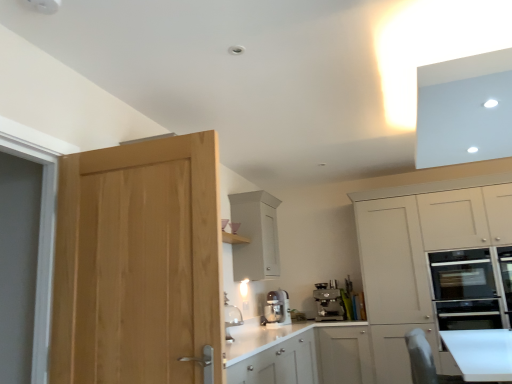
Question: Does natural wood door at left have a greater height compared to satin silver mixer at center, the second kitchen appliance viewed from the right?

Choices:
 (A) no
 (B) yes

Answer: (B)

Question: Are natural wood door at left and satin silver mixer at center, the 1th kitchen appliance in the left-to-right sequence, far apart?

Choices:
 (A) yes
 (B) no

Answer: (A)

Question: Is natural wood door at left positioned before satin silver mixer at center, the second kitchen appliance viewed from the right?

Choices:
 (A) no
 (B) yes

Answer: (B)

Question: Considering the relative sizes of natural wood door at left and satin silver mixer at center, the second kitchen appliance viewed from the right, in the image provided, is natural wood door at left smaller than satin silver mixer at center, the second kitchen appliance viewed from the right,?

Choices:
 (A) yes
 (B) no

Answer: (B)

Question: Considering the relative sizes of natural wood door at left and satin silver mixer at center, the second kitchen appliance viewed from the right, in the image provided, is natural wood door at left shorter than satin silver mixer at center, the second kitchen appliance viewed from the right,?

Choices:
 (A) no
 (B) yes

Answer: (A)

Question: Visually, is white matte cabinet at right, which is the 1th cabinetry from right to left, positioned to the left or to the right of white glossy countertop at center?

Choices:
 (A) right
 (B) left

Answer: (A)

Question: Based on their sizes in the image, would you say white matte cabinet at right, which is the 1th cabinetry from right to left, is bigger or smaller than white glossy countertop at center?

Choices:
 (A) big
 (B) small

Answer: (A)

Question: From a real-world perspective, is white matte cabinet at right, acting as the second cabinetry starting from the left, physically located above or below white glossy countertop at center?

Choices:
 (A) below
 (B) above

Answer: (B)

Question: Considering the positions of white matte cabinet at right, acting as the second cabinetry starting from the left, and white glossy countertop at center in the image, is white matte cabinet at right, acting as the second cabinetry starting from the left, taller or shorter than white glossy countertop at center?

Choices:
 (A) short
 (B) tall

Answer: (B)

Question: From the image's perspective, is white matte cabinet at upper center, which is counted as the second cabinetry, starting from the right, above or below natural wood door at left?

Choices:
 (A) above
 (B) below

Answer: (B)

Question: Would you say white matte cabinet at upper center, which ranks as the 1th cabinetry in left-to-right order, is to the left or to the right of natural wood door at left in the picture?

Choices:
 (A) left
 (B) right

Answer: (B)

Question: Is white matte cabinet at upper center, which is counted as the second cabinetry, starting from the right, taller or shorter than natural wood door at left?

Choices:
 (A) tall
 (B) short

Answer: (B)

Question: In the image, is white matte cabinet at upper center, which ranks as the 1th cabinetry in left-to-right order, positioned in front of or behind natural wood door at left?

Choices:
 (A) front
 (B) behind

Answer: (B)

Question: Is satin silver coffee machine at lower center, the first kitchen appliance viewed from the right, taller or shorter than white matte cabinet at upper center, which is counted as the second cabinetry, starting from the right?

Choices:
 (A) short
 (B) tall

Answer: (A)

Question: From the image's perspective, is satin silver coffee machine at lower center, the first kitchen appliance viewed from the right, positioned above or below white matte cabinet at upper center, which ranks as the 1th cabinetry in left-to-right order?

Choices:
 (A) below
 (B) above

Answer: (A)